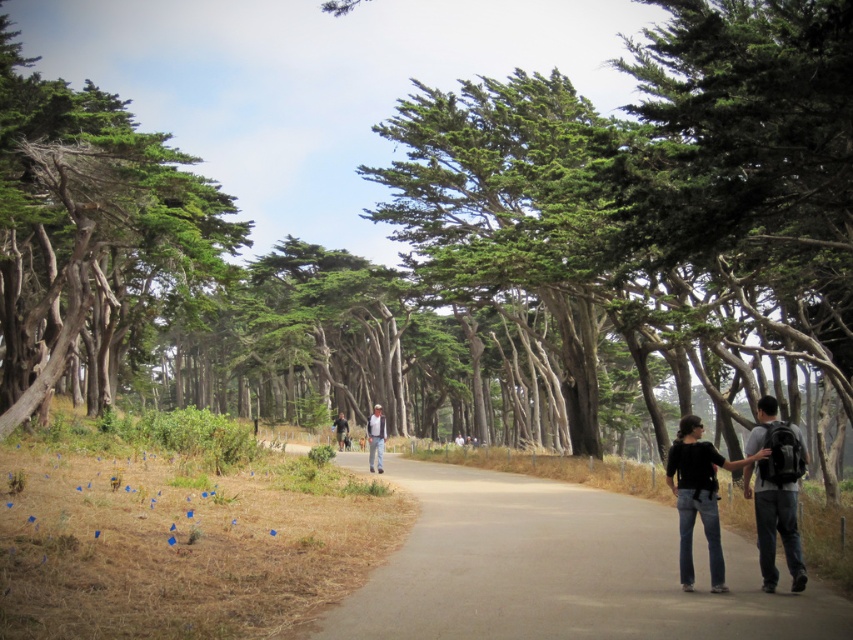
You are standing on the paved pathway in the forest and want to take a photo of the green textured trees at left and the light blue jeans at center. Which object should you focus on first if you want both to be in clear focus?

The green textured trees at left is larger than the light blue jeans at center, so you should focus on the green textured trees at left first to ensure both are in clear focus.

You are standing on the pathway in the forest and see two points marked in the scene. The first point is at coordinates point [25,259] and the second point is at point [776,577]. Which point is closer to you?

Point [25,259] is closer to you because it is further to the camera than point [776,577].